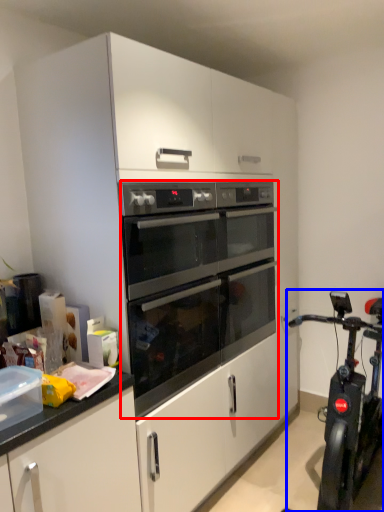
Question: Which point is further to the camera, oven (highlighted by a red box) or stationary bicycle (highlighted by a blue box)?

Choices:
 (A) oven
 (B) stationary bicycle

Answer: (A)